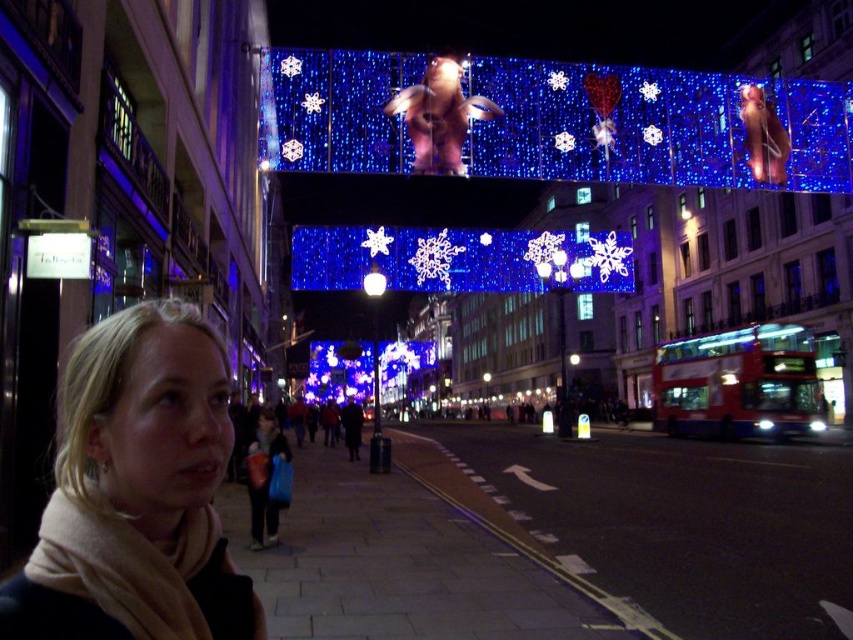
Question: Can you confirm if blonde hair at lower left is positioned below red metallic bus at right?

Choices:
 (A) yes
 (B) no

Answer: (B)

Question: Among these objects, which one is farthest from the camera?

Choices:
 (A) red metallic bus at right
 (B) blonde hair at lower left

Answer: (A)

Question: Does blue led lights at center appear on the left side of blonde hair at lower left?

Choices:
 (A) no
 (B) yes

Answer: (A)

Question: Which object is farther from the camera taking this photo?

Choices:
 (A) blue led lights at center
 (B) red metallic bus at right

Answer: (B)

Question: Which of the following is the closest to the observer?

Choices:
 (A) blonde hair at lower left
 (B) red metallic bus at right

Answer: (A)

Question: Can you confirm if blue led lights at center is positioned to the right of blonde hair at lower left?

Choices:
 (A) yes
 (B) no

Answer: (A)